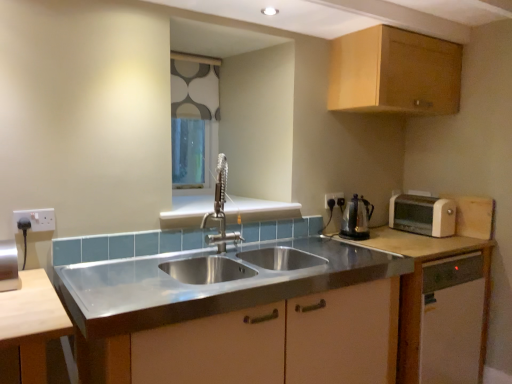
Describe the element at coordinates (422, 215) in the screenshot. I see `white plastic toaster at right` at that location.

This screenshot has height=384, width=512. What are the coordinates of `wooden cabinet at upper right, which is the 1th cabinetry from top to bottom` in the screenshot? It's located at coord(394,73).

In the scene shown: Which is farther from the camera, (208, 80) or (227, 172)?

Positioned behind is point (208, 80).

Between white fabric at upper center and polished stainless steel faucet at center, which one has smaller size?

polished stainless steel faucet at center.

Is polished stainless steel faucet at center completely or partially inside white fabric at upper center?

Definitely not — polished stainless steel faucet at center is not inside white fabric at upper center.

Is white fabric at upper center positioned far away from polished stainless steel faucet at center?

No, white fabric at upper center is in close proximity to polished stainless steel faucet at center.

Between white matte cabinet at right, the first cabinetry from the bottom, and stainless steel sink at center, which is counted as the 2th cabinetry, starting from the bottom, which one has smaller width?

With smaller width is white matte cabinet at right, the first cabinetry from the bottom.

Does white matte cabinet at right, the first cabinetry from the bottom, have a larger size compared to stainless steel sink at center, which is counted as the 2th cabinetry, starting from the bottom?

No, white matte cabinet at right, the first cabinetry from the bottom, is not bigger than stainless steel sink at center, which is counted as the 2th cabinetry, starting from the bottom.

Consider the image. Could you tell me if white matte cabinet at right, the first cabinetry from the bottom, is turned towards stainless steel sink at center, which is counted as the 2th cabinetry, starting from the bottom?

No, white matte cabinet at right, the first cabinetry from the bottom, is not facing towards stainless steel sink at center, which is counted as the 2th cabinetry, starting from the bottom.

Is white matte cabinet at right, the first cabinetry from the bottom, not inside stainless steel sink at center, which is counted as the 2th cabinetry, starting from the bottom?

white matte cabinet at right, the first cabinetry from the bottom, is positioned outside stainless steel sink at center, which is counted as the 2th cabinetry, starting from the bottom.

Measure the distance between white matte cabinet at right, the first cabinetry from the bottom, and white fabric at upper center.

white matte cabinet at right, the first cabinetry from the bottom, and white fabric at upper center are 4.42 feet apart.

Which is more to the right, white matte cabinet at right, the first cabinetry from the bottom, or white fabric at upper center?

Positioned to the right is white matte cabinet at right, the first cabinetry from the bottom.

Would you say white matte cabinet at right, the first cabinetry from the bottom, is inside or outside white fabric at upper center?

white matte cabinet at right, the first cabinetry from the bottom, exists outside the volume of white fabric at upper center.

Is point (483, 334) behind point (184, 186)?

No, (483, 334) is closer to viewer.

From the image's perspective, is white plastic toaster at right located above or below stainless steel sink at center, marked as the 2th cabinetry in a top-to-bottom arrangement?

Based on their image positions, white plastic toaster at right is located above stainless steel sink at center, marked as the 2th cabinetry in a top-to-bottom arrangement.

Consider the image. Is stainless steel sink at center, which is counted as the 2th cabinetry, starting from the bottom, surrounded by white plastic toaster at right?

Actually, stainless steel sink at center, which is counted as the 2th cabinetry, starting from the bottom, is outside white plastic toaster at right.

The height and width of the screenshot is (384, 512). Find the location of `toaster that is above the stainless steel sink at center, marked as the 2th cabinetry in a top-to-bottom arrangement (from the image's perspective)`. toaster that is above the stainless steel sink at center, marked as the 2th cabinetry in a top-to-bottom arrangement (from the image's perspective) is located at coordinates (422, 215).

Considering the sizes of objects white plastic toaster at right and stainless steel sink at center, marked as the 2th cabinetry in a top-to-bottom arrangement, in the image provided, who is wider, white plastic toaster at right or stainless steel sink at center, marked as the 2th cabinetry in a top-to-bottom arrangement,?

With larger width is stainless steel sink at center, marked as the 2th cabinetry in a top-to-bottom arrangement.

Does white plastic socket at left, positioned as the 1th electric outlet in left-to-right order, have a larger size compared to polished stainless steel faucet at center?

No.

Which object is further away from the camera taking this photo, white plastic socket at left, positioned as the 1th electric outlet in left-to-right order, or polished stainless steel faucet at center?

polished stainless steel faucet at center.

Measure the distance between white plastic socket at left, which is counted as the 2th electric outlet, starting from the right, and polished stainless steel faucet at center.

They are 72.59 centimeters apart.

Is there a large distance between white plastic toaster at right and polished stainless steel faucet at center?

That's right, there is a large distance between white plastic toaster at right and polished stainless steel faucet at center.

Which is more to the left, white plastic toaster at right or polished stainless steel faucet at center?

polished stainless steel faucet at center.

From the image's perspective, is white plastic toaster at right above polished stainless steel faucet at center?

No.

Looking at this image, is white plastic electrical outlet at upper right, which appears as the 2th electric outlet when viewed from the left, not within white matte cabinet at right, which appears as the third cabinetry when viewed from the top?

Yes, white plastic electrical outlet at upper right, which appears as the 2th electric outlet when viewed from the left, is located beyond the bounds of white matte cabinet at right, which appears as the third cabinetry when viewed from the top.

From the image's perspective, between white plastic electrical outlet at upper right, which appears as the 2th electric outlet when viewed from the left, and white matte cabinet at right, which appears as the third cabinetry when viewed from the top, who is located below?

white matte cabinet at right, which appears as the third cabinetry when viewed from the top, is shown below in the image.

Is point (326, 201) closer or farther from the camera than point (407, 379)?

Point (326, 201) is positioned farther from the camera compared to point (407, 379).

Considering the relative sizes of white plastic electrical outlet at upper right, which appears as the 2th electric outlet when viewed from the left, and white matte cabinet at right, which appears as the third cabinetry when viewed from the top, in the image provided, is white plastic electrical outlet at upper right, which appears as the 2th electric outlet when viewed from the left, wider than white matte cabinet at right, which appears as the third cabinetry when viewed from the top,?

No.

This screenshot has height=384, width=512. I want to click on tap lying below the white fabric at upper center (from the image's perspective), so click(x=220, y=209).

Locate an element on the screen. the 2nd cabinetry to the right when counting from the stainless steel sink at center, marked as the 2th cabinetry in a top-to-bottom arrangement is located at coordinates (424, 292).

Based on their spatial positions, is white matte cabinet at right, which appears as the third cabinetry when viewed from the top, or wooden cabinet at upper right, the third cabinetry in the bottom-to-top sequence, closer to polished stainless steel faucet at center?

white matte cabinet at right, which appears as the third cabinetry when viewed from the top, lies closer to polished stainless steel faucet at center than the other object.

Considering their positions, is white matte cabinet at right, the first cabinetry from the bottom, positioned further to white plastic toaster at right than shiny metallic kettle at right?

Based on the image, shiny metallic kettle at right appears to be further to white plastic toaster at right.

Estimate the real-world distances between objects in this image. Which object is further from white plastic electrical outlet at upper right, which appears as the 2th electric outlet when viewed from the left, shiny metallic kettle at right or stainless steel sink at center, which is counted as the 2th cabinetry, starting from the bottom?

stainless steel sink at center, which is counted as the 2th cabinetry, starting from the bottom, is further to white plastic electrical outlet at upper right, which appears as the 2th electric outlet when viewed from the left.

Estimate the real-world distances between objects in this image. Which object is closer to white matte cabinet at right, the first cabinetry from the bottom, shiny metallic kettle at right or white plastic electrical outlet at upper right, placed as the first electric outlet when sorted from right to left?

The object closer to white matte cabinet at right, the first cabinetry from the bottom, is shiny metallic kettle at right.

Considering their positions, is white fabric at upper center positioned further to white plastic toaster at right than shiny metallic kettle at right?

The object further to white plastic toaster at right is white fabric at upper center.

Based on their spatial positions, is white matte cabinet at right, the first cabinetry from the bottom, or white plastic toaster at right further from white plastic socket at left, which appears as the 2th electric outlet when viewed from the back?

white plastic toaster at right.

Based on their spatial positions, is white matte cabinet at right, the first cabinetry from the bottom, or polished stainless steel faucet at center further from white plastic toaster at right?

polished stainless steel faucet at center lies further to white plastic toaster at right than the other object.

Considering their positions, is shiny metallic kettle at right positioned further to polished stainless steel faucet at center than white plastic toaster at right?

white plastic toaster at right lies further to polished stainless steel faucet at center than the other object.

Where is `tap positioned between stainless steel sink at center, marked as the 2th cabinetry in a top-to-bottom arrangement, and shiny metallic kettle at right from near to far`? The height and width of the screenshot is (384, 512). tap positioned between stainless steel sink at center, marked as the 2th cabinetry in a top-to-bottom arrangement, and shiny metallic kettle at right from near to far is located at coordinates (220, 209).

Identify the location of tap between wooden cabinet at upper right, which is the 1th cabinetry from top to bottom, and white matte cabinet at right, the first cabinetry from the bottom, in the up-down direction. (220, 209).

The height and width of the screenshot is (384, 512). Identify the location of toaster between stainless steel sink at center, which is counted as the 2th cabinetry, starting from the bottom, and white fabric at upper center from front to back. (422, 215).

At what (x,y) coordinates should I click in order to perform the action: click on appliance between wooden cabinet at upper right, the third cabinetry in the bottom-to-top sequence, and white plastic toaster at right, in the vertical direction. Please return your answer as a coordinate pair (x, y). Image resolution: width=512 pixels, height=384 pixels. Looking at the image, I should click on (355, 218).